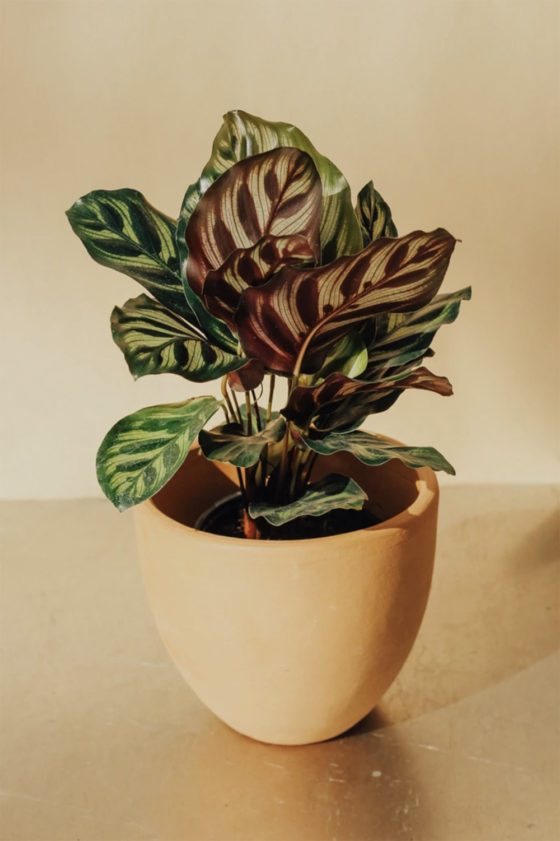
The width and height of the screenshot is (560, 841). In order to click on pot in this screenshot , I will do `click(282, 620)`.